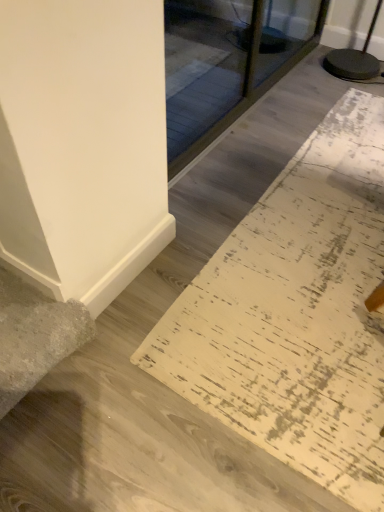
Describe the element at coordinates (240, 72) in the screenshot. I see `transparent glass door at upper center` at that location.

This screenshot has height=512, width=384. What are the coordinates of `transparent glass door at upper center` in the screenshot? It's located at (240, 72).

What is the approximate width of transparent glass door at upper center?

transparent glass door at upper center is 10.35 centimeters in width.

Measure the distance between transparent glass door at upper center and camera.

transparent glass door at upper center is 5.92 feet away from camera.

Image resolution: width=384 pixels, height=512 pixels. Identify the location of white distressed rug at lower right. (296, 313).

Image resolution: width=384 pixels, height=512 pixels. What do you see at coordinates (296, 313) in the screenshot?
I see `white distressed rug at lower right` at bounding box center [296, 313].

This screenshot has width=384, height=512. Identify the location of transparent glass door at upper center. (240, 72).

Is white distressed rug at lower right to the left of transparent glass door at upper center from the viewer's perspective?

Incorrect, white distressed rug at lower right is not on the left side of transparent glass door at upper center.

Relative to transparent glass door at upper center, is white distressed rug at lower right in front or behind?

Visually, white distressed rug at lower right is located in front of transparent glass door at upper center.

Between point (380, 196) and point (167, 33), which one is positioned behind?

The point (167, 33) is behind.

From the image's perspective, is white distressed rug at lower right located above or below transparent glass door at upper center?

Clearly, from the image's perspective, white distressed rug at lower right is below transparent glass door at upper center.

From a real-world perspective, is white distressed rug at lower right located beneath transparent glass door at upper center?

Answer: Yes, from a real-world perspective, white distressed rug at lower right is below transparent glass door at upper center.

Between white distressed rug at lower right and transparent glass door at upper center, which one has smaller width?

With smaller width is transparent glass door at upper center.

From the picture: Between white distressed rug at lower right and transparent glass door at upper center, which one has more height?

Standing taller between the two is transparent glass door at upper center.

Can you confirm if white distressed rug at lower right is bigger than transparent glass door at upper center?

No.

In the scene shown: Is white distressed rug at lower right inside the boundaries of transparent glass door at upper center, or outside?

white distressed rug at lower right is not enclosed by transparent glass door at upper center.

Is white distressed rug at lower right next to transparent glass door at upper center and touching it?

white distressed rug at lower right is not next to transparent glass door at upper center, and they're not touching.

Does white distressed rug at lower right turn towards transparent glass door at upper center?

No, white distressed rug at lower right is not facing towards transparent glass door at upper center.

How different are the orientations of white distressed rug at lower right and transparent glass door at upper center in degrees?

The angle between the facing direction of white distressed rug at lower right and the facing direction of transparent glass door at upper center is 89.2 degrees.

How much distance is there between white distressed rug at lower right and transparent glass door at upper center?

They are 3.32 feet apart.

At what (x,y) coordinates should I click in order to perform the action: click on glass door above the white distressed rug at lower right (from the image's perspective). Please return your answer as a coordinate pair (x, y). The image size is (384, 512). Looking at the image, I should click on (240, 72).

Which is more to the right, transparent glass door at upper center or white distressed rug at lower right?

From the viewer's perspective, white distressed rug at lower right appears more on the right side.

Which is behind, transparent glass door at upper center or white distressed rug at lower right?

transparent glass door at upper center is further away from the camera.

Considering the points (284, 19) and (325, 125), which point is in front, point (284, 19) or point (325, 125)?

Point (325, 125)

From the image's perspective, which one is positioned higher, transparent glass door at upper center or white distressed rug at lower right?

transparent glass door at upper center appears higher in the image.

From a real-world perspective, is transparent glass door at upper center on white distressed rug at lower right?

Correct, in the physical world, transparent glass door at upper center is higher than white distressed rug at lower right.

Between transparent glass door at upper center and white distressed rug at lower right, which one has smaller width?

transparent glass door at upper center.

Between transparent glass door at upper center and white distressed rug at lower right, which one has more height?

Standing taller between the two is transparent glass door at upper center.

Which of these two, transparent glass door at upper center or white distressed rug at lower right, is bigger?

Bigger between the two is transparent glass door at upper center.

Could white distressed rug at lower right be considered to be inside transparent glass door at upper center?

Result: That's incorrect, white distressed rug at lower right is not inside transparent glass door at upper center.

Is transparent glass door at upper center not near white distressed rug at lower right?

transparent glass door at upper center is positioned a significant distance from white distressed rug at lower right.

Is white distressed rug at lower right at the back of transparent glass door at upper center?

That's not correct — transparent glass door at upper center is not looking away from white distressed rug at lower right.

This screenshot has height=512, width=384. What are the coordinates of `glass door to the left of white distressed rug at lower right` in the screenshot? It's located at (240, 72).

In order to click on doormat on the right of transparent glass door at upper center in this screenshot , I will do `click(296, 313)`.

Find the location of `glass door that is on the left side of white distressed rug at lower right`. glass door that is on the left side of white distressed rug at lower right is located at coordinates (240, 72).